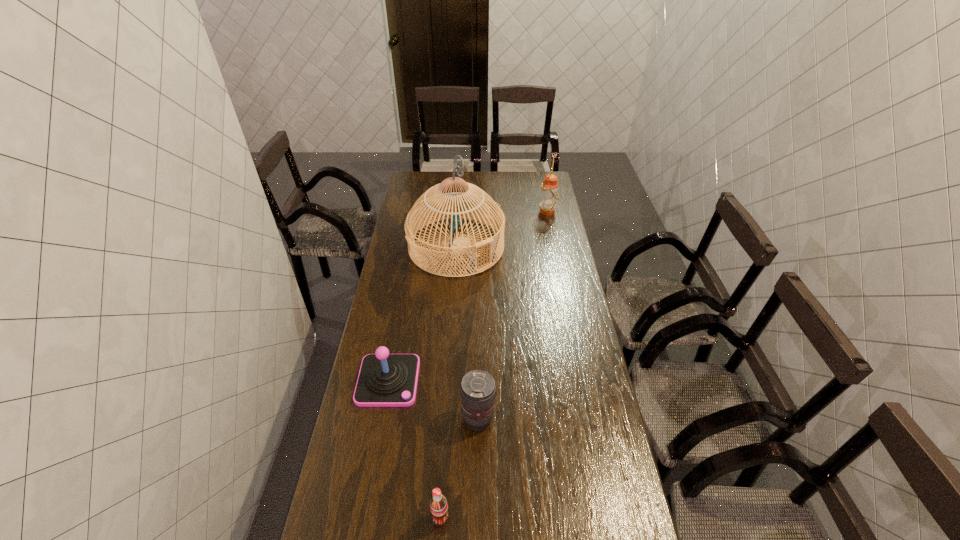
I want to click on vacant position in the image that satisfies the following two spatial constraints: 1. on the back side of the fourth nearest object; 2. on the right side of the fourth shortest object, so click(459, 212).

Find the location of a particular element. This screenshot has height=540, width=960. vacant space that satisfies the following two spatial constraints: 1. forward from the base of the joystick; 2. on the left side of the nearest object is located at coordinates (363, 517).